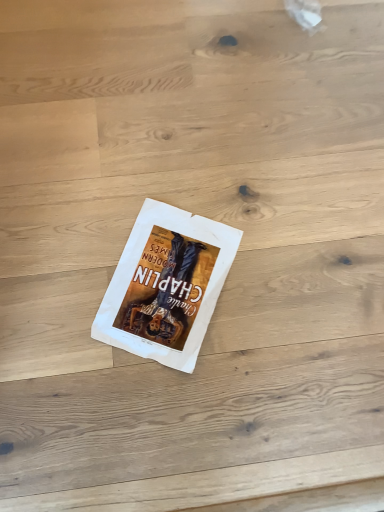
Where is `vacant space in front of white paper book at center`? Image resolution: width=384 pixels, height=512 pixels. vacant space in front of white paper book at center is located at coordinates (144, 408).